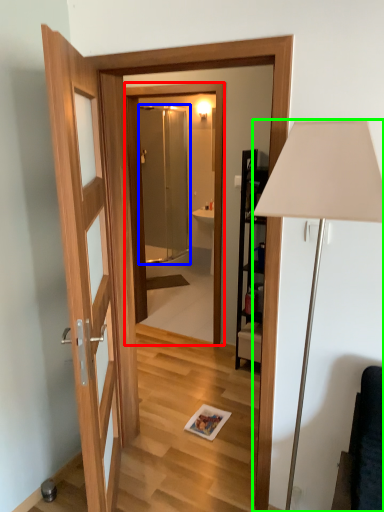
Question: Considering the real-world distances, which object is farthest from mirror (highlighted by a red box)? screen door (highlighted by a blue box) or lamp (highlighted by a green box)?

Choices:
 (A) screen door
 (B) lamp

Answer: (B)